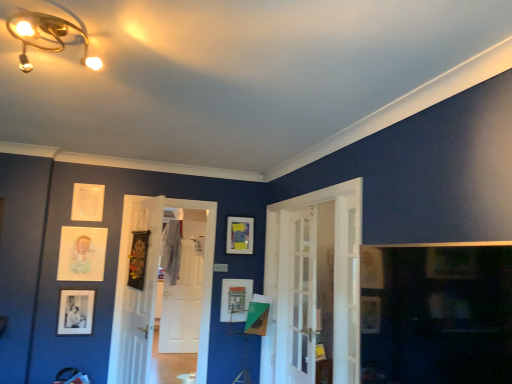
Question: Which direction should I rotate to look at matte white picture frame at center, which is counted as the 4th picture frame, starting from the left, — up or down?

Choices:
 (A) up
 (B) down

Answer: (B)

Question: From the image's perspective, would you say clear glass screen door at center is shown under white glass door at center, the 1th door from the right?

Choices:
 (A) no
 (B) yes

Answer: (B)

Question: Is the position of clear glass screen door at center more distant than that of white glass door at center, the 1th door from the right?

Choices:
 (A) yes
 (B) no

Answer: (A)

Question: Is clear glass screen door at center shorter than white glass door at center, placed as the 1th door when sorted from front to back?

Choices:
 (A) no
 (B) yes

Answer: (B)

Question: Are clear glass screen door at center and white glass door at center, which is counted as the 3th door, starting from the left, located far from each other?

Choices:
 (A) yes
 (B) no

Answer: (B)

Question: Can you confirm if clear glass screen door at center is thinner than white glass door at center, which is counted as the 3th door, starting from the left?

Choices:
 (A) yes
 (B) no

Answer: (A)

Question: Are clear glass screen door at center and white glass door at center, which is counted as the third door, starting from the back, beside each other?

Choices:
 (A) no
 (B) yes

Answer: (A)

Question: Considering the relative sizes of black matte picture frame at lower left, the 5th picture frame viewed from the right, and wooden textured picture frame at center, the third picture frame from the left, in the image provided, is black matte picture frame at lower left, the 5th picture frame viewed from the right, wider than wooden textured picture frame at center, the third picture frame from the left,?

Choices:
 (A) yes
 (B) no

Answer: (B)

Question: Is black matte picture frame at lower left, the 5th picture frame viewed from the right, outside wooden textured picture frame at center, the third picture frame from the left?

Choices:
 (A) yes
 (B) no

Answer: (A)

Question: Considering the relative sizes of black matte picture frame at lower left, acting as the first picture frame starting from the left, and wooden textured picture frame at center, the third picture frame from the left, in the image provided, is black matte picture frame at lower left, acting as the first picture frame starting from the left, smaller than wooden textured picture frame at center, the third picture frame from the left,?

Choices:
 (A) no
 (B) yes

Answer: (B)

Question: From a real-world perspective, is black matte picture frame at lower left, acting as the first picture frame starting from the left, located beneath wooden textured picture frame at center, which is counted as the 3th picture frame, starting from the right?

Choices:
 (A) yes
 (B) no

Answer: (A)

Question: Does black matte picture frame at lower left, the 5th picture frame viewed from the right, have a larger size compared to wooden textured picture frame at center, which is counted as the 3th picture frame, starting from the right?

Choices:
 (A) no
 (B) yes

Answer: (A)

Question: Considering the relative sizes of black matte picture frame at lower left, the 5th picture frame viewed from the right, and wooden textured picture frame at center, which is counted as the 3th picture frame, starting from the right, in the image provided, is black matte picture frame at lower left, the 5th picture frame viewed from the right, thinner than wooden textured picture frame at center, which is counted as the 3th picture frame, starting from the right,?

Choices:
 (A) yes
 (B) no

Answer: (A)

Question: Does wooden textured picture frame at center, the third picture frame from the left, lie in front of clear glass screen door at center?

Choices:
 (A) yes
 (B) no

Answer: (B)